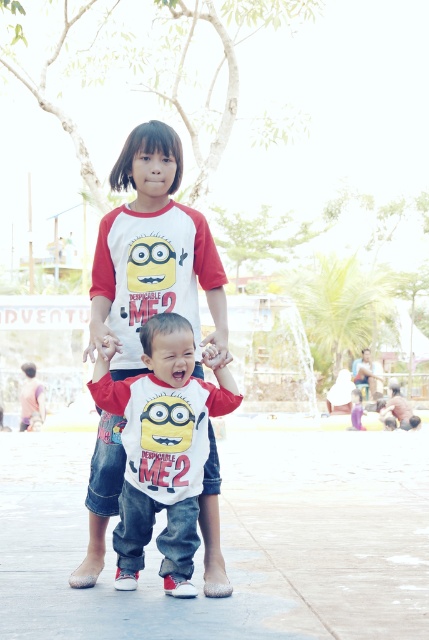
Is concrete at center above white matte shirt at center?

Incorrect, concrete at center is not positioned above white matte shirt at center.

Is point (423, 577) less distant than point (126, 552)?

No, (423, 577) is behind (126, 552).

The image size is (429, 640). Identify the location of concrete at center. (232, 541).